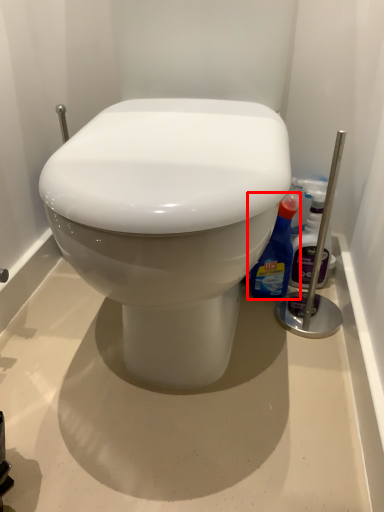
Question: From the image's perspective, where is cleaning product (annotated by the red box) located in relation to cleaning product in the image?

Choices:
 (A) below
 (B) above

Answer: (A)